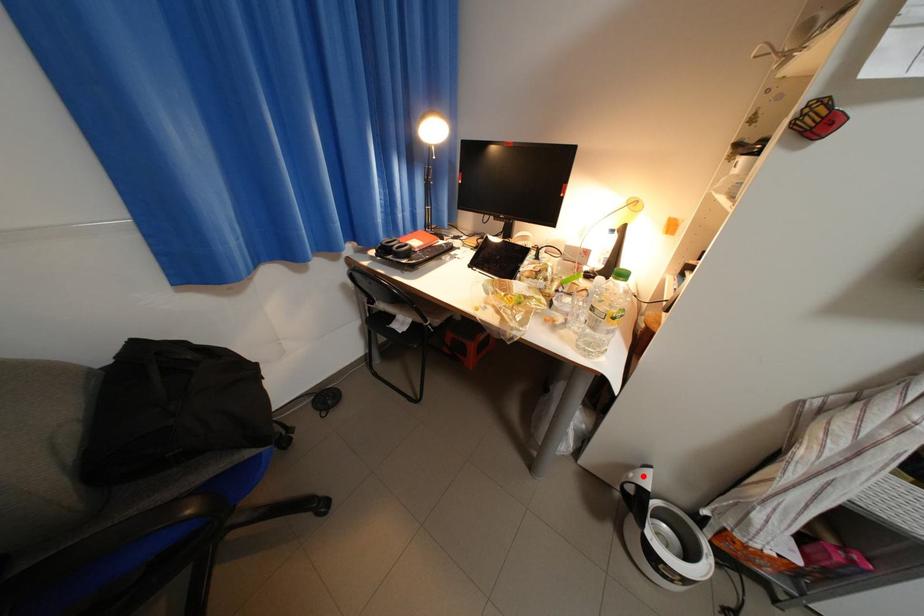
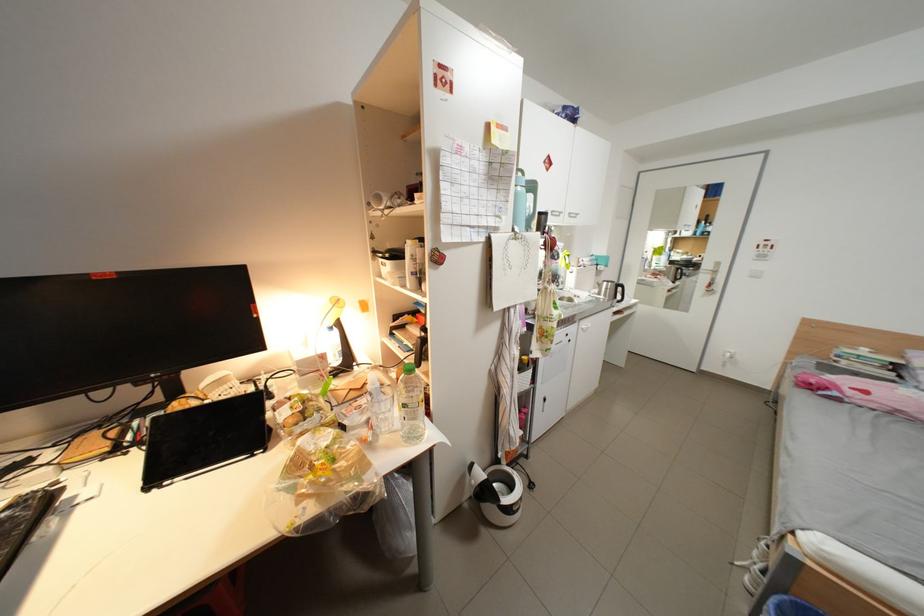
Question: I am providing you with two images of the same scene from different viewpoints. In image1, a red point is highlighted. Considering the same 3D point in image2, which of the following is correct?

Choices:
 (A) It is closer
 (B) It is farther

Answer: (A)